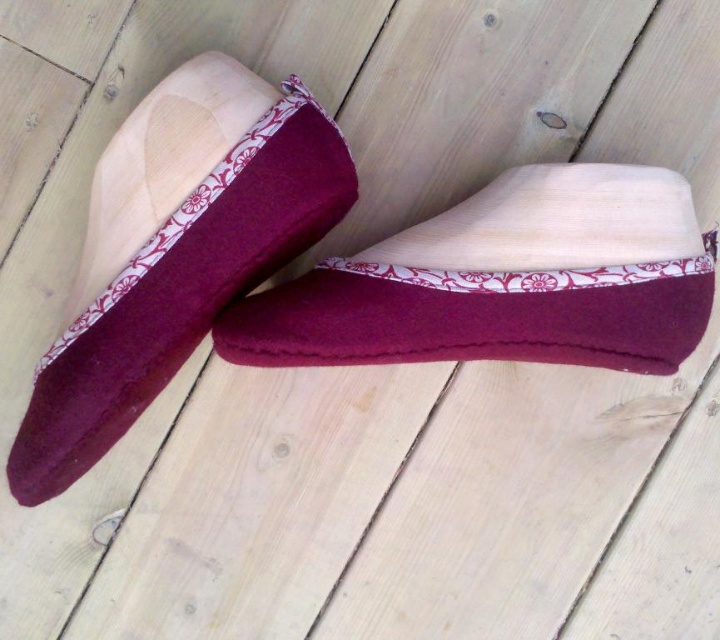
Looking at this image, does burgundy felt slipper at center have a lesser height compared to burgundy felt sock at center?

Yes.

Between burgundy felt slipper at center and burgundy felt sock at center, which one appears on the right side from the viewer's perspective?

From the viewer's perspective, burgundy felt slipper at center appears more on the right side.

Which is in front, point (463, 248) or point (117, 388)?

Point (117, 388) is more forward.

At what (x,y) coordinates should I click in order to perform the action: click on burgundy felt slipper at center. Please return your answer as a coordinate pair (x, y). This screenshot has width=720, height=640. Looking at the image, I should click on (504, 282).